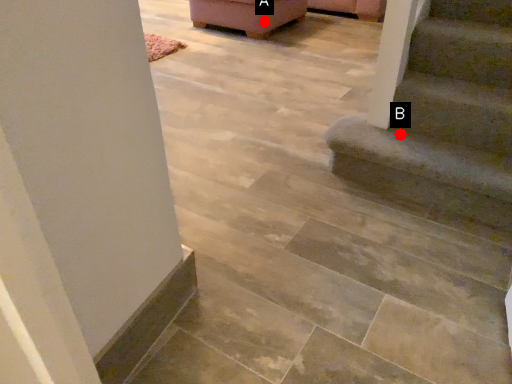
Question: Two points are circled on the image, labeled by A and B beside each circle. Which point is farther from the camera taking this photo?

Choices:
 (A) A is further
 (B) B is further

Answer: (A)